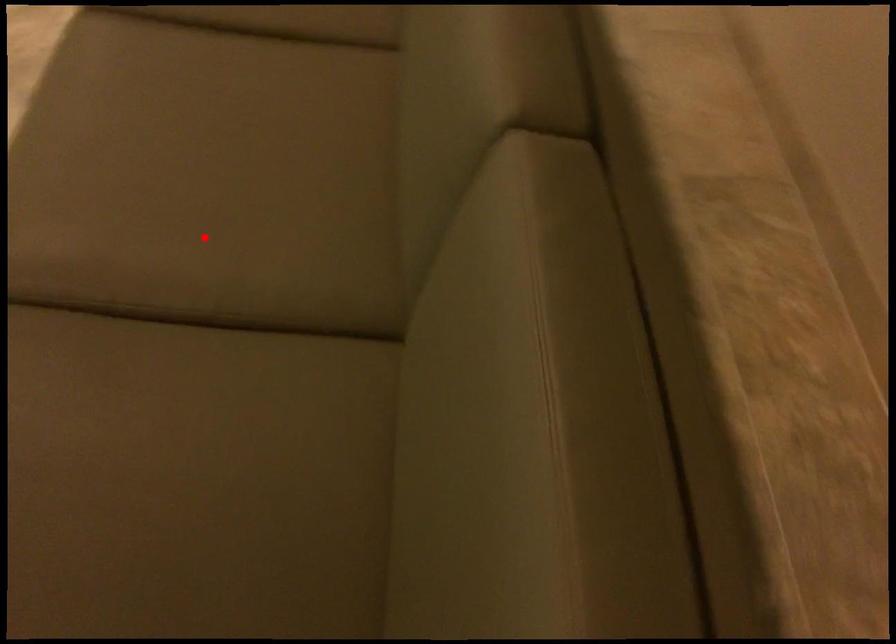
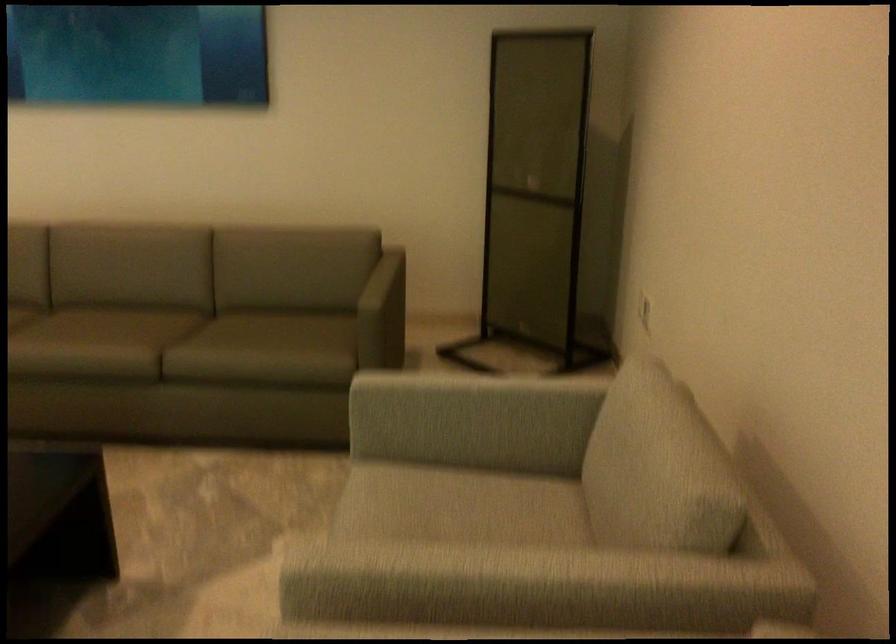
Question: I am providing you with two images of the same scene from different viewpoints. Given a red point in image1, look at the same physical point in image2. Is it:

Choices:
 (A) Closer to the viewpoint
 (B) Farther from the viewpoint

Answer: (B)